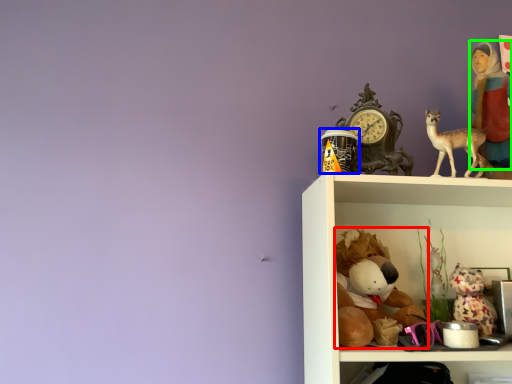
Question: Which is farther away from toy (highlighted by a red box)? toy (highlighted by a blue box) or person (highlighted by a green box)?

Choices:
 (A) toy
 (B) person

Answer: (B)